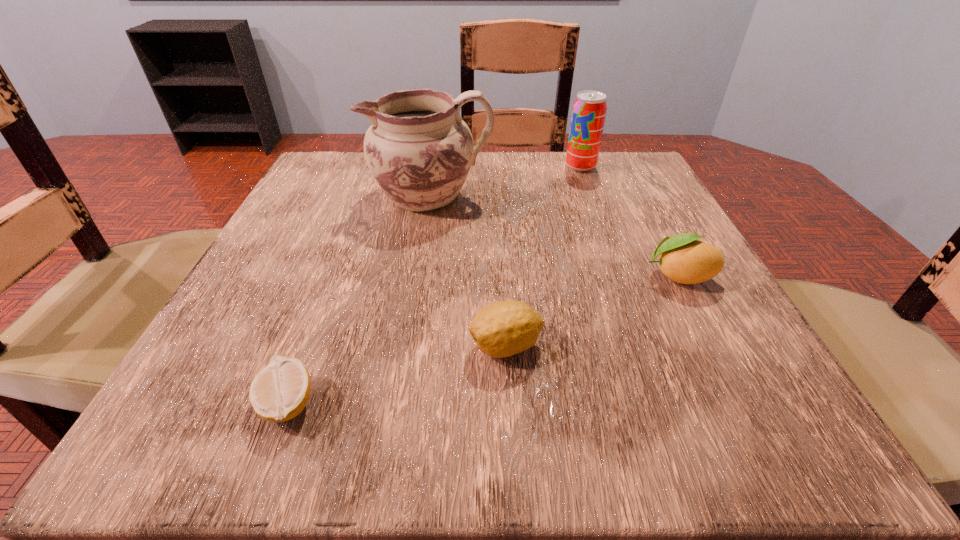
This screenshot has height=540, width=960. I want to click on pitcher, so click(419, 150).

The image size is (960, 540). Find the location of `soda can`. soda can is located at coordinates (589, 110).

The image size is (960, 540). I want to click on the fourth object from left to right, so click(x=589, y=110).

Identify the location of the third nearest object. (684, 259).

Where is `the farthest lemon`? the farthest lemon is located at coordinates (684, 259).

Find the location of a particular element. the second nearest object is located at coordinates (502, 329).

The image size is (960, 540). What are the coordinates of `the second nearest lemon` in the screenshot? It's located at (502, 329).

Image resolution: width=960 pixels, height=540 pixels. In order to click on the leftmost lemon in this screenshot , I will do `click(279, 392)`.

The image size is (960, 540). I want to click on the nearest lemon, so click(x=279, y=392).

Where is `vacant space located 0.110m on the spout of the tallest object`? The width and height of the screenshot is (960, 540). vacant space located 0.110m on the spout of the tallest object is located at coordinates (313, 195).